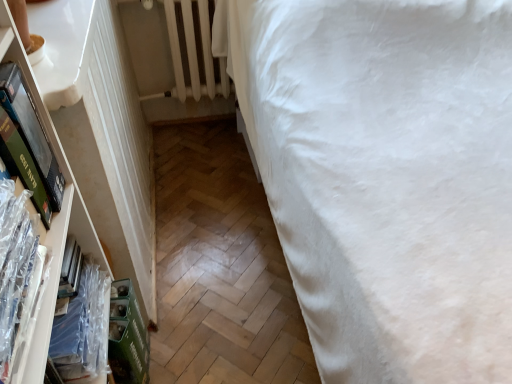
Question: Are white cotton bed at right and clear plastic book at left, which is the 2th book in front-to-back order, located far from each other?

Choices:
 (A) no
 (B) yes

Answer: (A)

Question: Is the position of white cotton bed at right less distant than that of clear plastic book at left, which is the 2th book in front-to-back order?

Choices:
 (A) yes
 (B) no

Answer: (A)

Question: Does white cotton bed at right have a lesser width compared to clear plastic book at left, which is the 2th book in front-to-back order?

Choices:
 (A) yes
 (B) no

Answer: (B)

Question: Is white cotton bed at right outside of clear plastic book at left, which ranks as the 1th book in back-to-front order?

Choices:
 (A) yes
 (B) no

Answer: (A)

Question: Does white cotton bed at right have a greater width compared to clear plastic book at left, which ranks as the 1th book in back-to-front order?

Choices:
 (A) no
 (B) yes

Answer: (B)

Question: From a real-world perspective, relative to white painted metal radiator at upper left, is clear plastic book at left, arranged as the second book when viewed from the back, vertically above or below?

Choices:
 (A) below
 (B) above

Answer: (B)

Question: Is point (10, 286) closer or farther from the camera than point (208, 92)?

Choices:
 (A) farther
 (B) closer

Answer: (B)

Question: Based on their sizes in the image, would you say clear plastic book at left, arranged as the second book when viewed from the back, is bigger or smaller than white painted metal radiator at upper left?

Choices:
 (A) big
 (B) small

Answer: (B)

Question: Considering the relative positions of clear plastic book at left, arranged as the second book when viewed from the back, and white painted metal radiator at upper left in the image provided, is clear plastic book at left, arranged as the second book when viewed from the back, to the left or to the right of white painted metal radiator at upper left?

Choices:
 (A) right
 (B) left

Answer: (B)

Question: Is clear plastic book at left, which ranks as the 1th book in back-to-front order, spatially inside clear plastic book at left, arranged as the second book when viewed from the back, or outside of it?

Choices:
 (A) inside
 (B) outside

Answer: (B)

Question: In the image, is clear plastic book at left, which ranks as the 1th book in back-to-front order, on the left side or the right side of clear plastic book at left, arranged as the second book when viewed from the back?

Choices:
 (A) right
 (B) left

Answer: (B)

Question: Considering their positions, is clear plastic book at left, which ranks as the 1th book in back-to-front order, located in front of or behind clear plastic book at left, arranged as the second book when viewed from the back?

Choices:
 (A) front
 (B) behind

Answer: (B)

Question: From the image's perspective, is clear plastic book at left, which ranks as the 1th book in back-to-front order, located above or below clear plastic book at left, arranged as the second book when viewed from the back?

Choices:
 (A) below
 (B) above

Answer: (A)

Question: In terms of height, does green matte book at left look taller or shorter compared to clear plastic book at left, the 1th book viewed from the front?

Choices:
 (A) short
 (B) tall

Answer: (B)

Question: Based on their positions, is green matte book at left located to the left or right of clear plastic book at left, arranged as the second book when viewed from the back?

Choices:
 (A) left
 (B) right

Answer: (A)